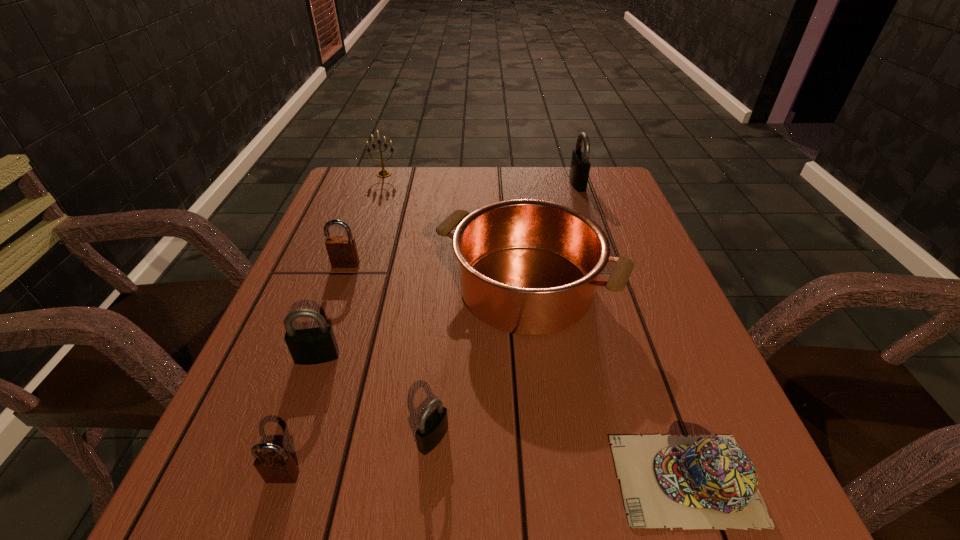
Locate an element on the screen. This screenshot has width=960, height=540. the rightmost padlock is located at coordinates (580, 165).

Identify the location of the biggest black padlock. This screenshot has height=540, width=960. (580, 165).

Where is `candelabrum`? Image resolution: width=960 pixels, height=540 pixels. candelabrum is located at coordinates pyautogui.click(x=383, y=173).

This screenshot has height=540, width=960. I want to click on saucepan, so click(529, 267).

In order to click on the bigger brown padlock in this screenshot , I will do `click(342, 250)`.

Image resolution: width=960 pixels, height=540 pixels. In order to click on the fourth nearest padlock in this screenshot , I will do (x=342, y=250).

The width and height of the screenshot is (960, 540). I want to click on the leftmost black padlock, so click(x=310, y=346).

Locate an element on the screen. the second smallest black padlock is located at coordinates (310, 346).

I want to click on the fourth farthest padlock, so click(432, 428).

Identify the location of the second black padlock from left to right. This screenshot has width=960, height=540. (432, 428).